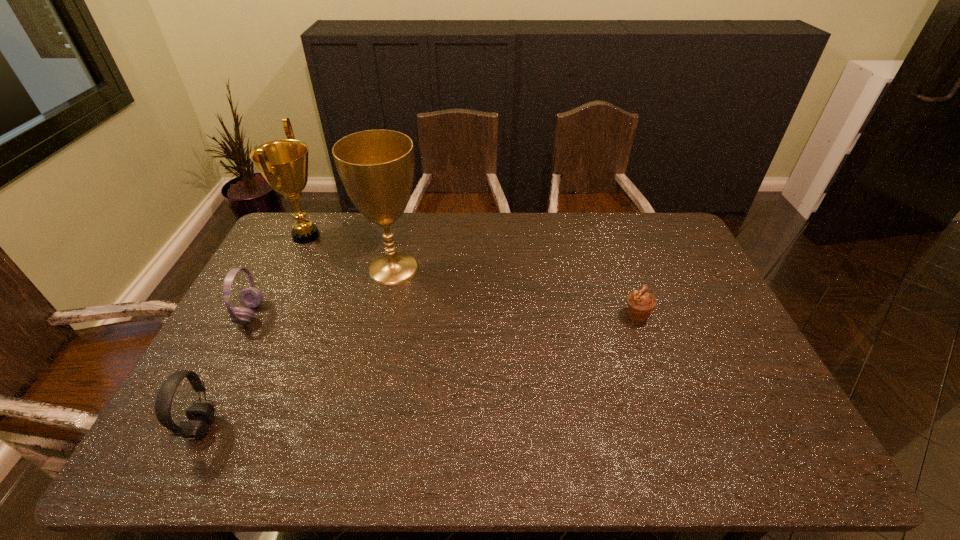
The width and height of the screenshot is (960, 540). Identify the location of vacant space located on the right of the shortest object. (713, 315).

Locate an element on the screen. Image resolution: width=960 pixels, height=540 pixels. trophy cup located in the far edge section of the desktop is located at coordinates (376, 167).

Find the location of `award present at the far edge`. award present at the far edge is located at coordinates (283, 163).

Find the location of a particular element. Image resolution: width=960 pixels, height=540 pixels. object located at the near edge is located at coordinates (200, 415).

This screenshot has width=960, height=540. I want to click on award that is at the left edge, so click(x=283, y=163).

This screenshot has width=960, height=540. I want to click on object that is at the far left corner, so click(x=283, y=163).

Image resolution: width=960 pixels, height=540 pixels. Identify the location of object that is at the near left corner. (200, 415).

The height and width of the screenshot is (540, 960). I want to click on vacant space at the far edge, so click(437, 246).

The width and height of the screenshot is (960, 540). In order to click on vacant region at the near edge of the desktop in this screenshot , I will do `click(676, 470)`.

The image size is (960, 540). What are the coordinates of `free spot at the left edge of the desktop` in the screenshot? It's located at (271, 313).